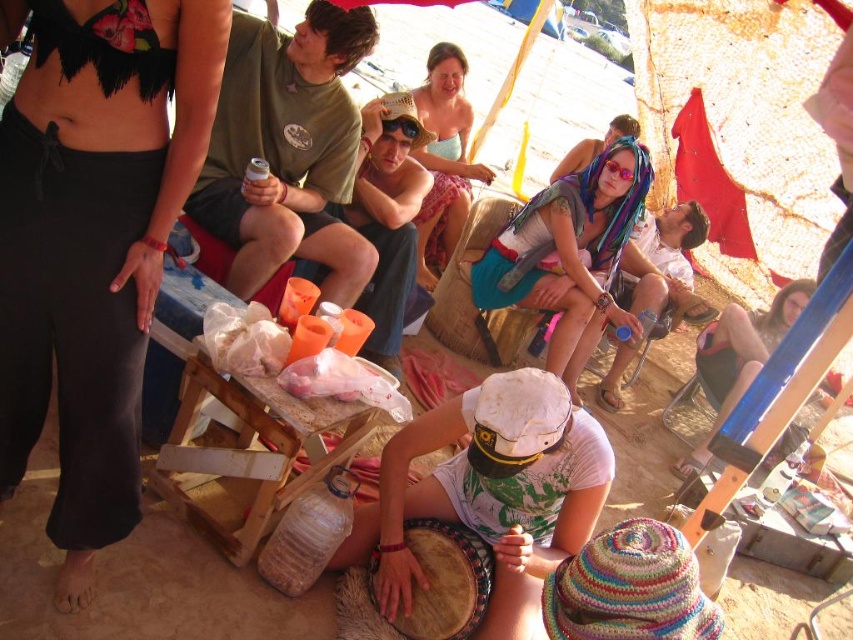
Question: Can you confirm if multicolored fabric scarf at center is positioned below matte black sunglasses at upper right?

Choices:
 (A) yes
 (B) no

Answer: (B)

Question: Which of the following is the farthest from the observer?

Choices:
 (A) matte black sunglasses at upper right
 (B) black fabric bikini top at upper left
 (C) light blue fabric dress at center
 (D) brown leather drum at center

Answer: (C)

Question: Is wooden stool at center below light blue fabric dress at center?

Choices:
 (A) no
 (B) yes

Answer: (B)

Question: Which object is positioned closest to the matte black sunglasses at upper right?

Choices:
 (A) multicolored fabric scarf at center
 (B) light blue fabric dress at center
 (C) brown leather drum at center

Answer: (A)

Question: Which point appears farthest from the camera in this image?

Choices:
 (A) (84, 244)
 (B) (761, 362)
 (C) (589, 298)
 (D) (276, 497)

Answer: (C)

Question: Where is black fabric bikini top at upper left located in relation to multicolored fabric scarf at center in the image?

Choices:
 (A) above
 (B) below

Answer: (B)